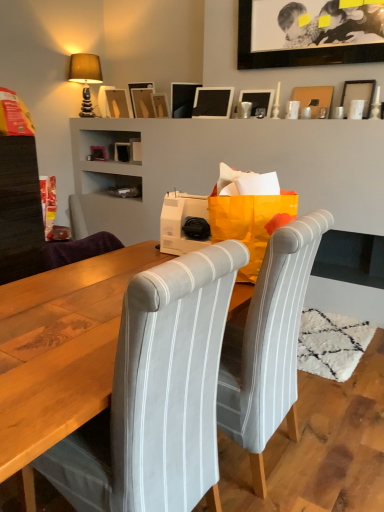
Looking at this image, in order to face matte black picture frame at upper center, acting as the 5th picture frame starting from the left, should I rotate leftwards or rightwards?

To face it directly, rotate right by 2.395 degrees.

Measure the distance between white striped fabric chair at center, marked as the 2th chair in a left-to-right arrangement, and camera.

A distance of 1.31 meters exists between white striped fabric chair at center, marked as the 2th chair in a left-to-right arrangement, and camera.

The width and height of the screenshot is (384, 512). What are the coordinates of `matte wood picture frame at upper center, marked as the 1th picture frame in a left-to-right arrangement` in the screenshot? It's located at (117, 103).

Find the location of a particular element. wooden picture frame at upper center, the seventh picture frame when ordered from right to left is located at coordinates (160, 105).

Image resolution: width=384 pixels, height=512 pixels. I want to click on matte black picture frame at upper center, acting as the 5th picture frame starting from the left, so click(x=213, y=102).

You are a GUI agent. You are given a task and a screenshot of the screen. Output one action in this format:
    pyautogui.click(x=<x>, y=<y>)
    Task: Click on the lamp that is on the left side of matte black picture frame at upper center, which ranks as the eighth picture frame in right-to-left order
    
    Given the screenshot: What is the action you would take?
    pyautogui.click(x=85, y=78)

Considering the relative positions of matte black picture frame at upper center, placed as the 2th picture frame when sorted from left to right, and matte brown fabric lampshade at upper left in the image provided, is matte black picture frame at upper center, placed as the 2th picture frame when sorted from left to right, to the right of matte brown fabric lampshade at upper left from the viewer's perspective?

Yes.

Is matte black picture frame at upper center, which ranks as the eighth picture frame in right-to-left order, with matte brown fabric lampshade at upper left?

matte black picture frame at upper center, which ranks as the eighth picture frame in right-to-left order, and matte brown fabric lampshade at upper left are not in contact.

How different are the orientations of matte black picture frame at upper center, which ranks as the eighth picture frame in right-to-left order, and matte brown fabric lampshade at upper left in degrees?

There is a 177-degree angle between the facing directions of matte black picture frame at upper center, which ranks as the eighth picture frame in right-to-left order, and matte brown fabric lampshade at upper left.

Is black matte picture frame at upper center, which ranks as the 3th picture frame in right-to-left order, bigger than wooden picture frame at upper center, the seventh picture frame when ordered from right to left?

Yes, black matte picture frame at upper center, which ranks as the 3th picture frame in right-to-left order, is bigger than wooden picture frame at upper center, the seventh picture frame when ordered from right to left.

Considering the positions of objects black matte picture frame at upper center, which ranks as the 3th picture frame in right-to-left order, and wooden picture frame at upper center, marked as the third picture frame in a left-to-right arrangement, in the image provided, who is more to the left, black matte picture frame at upper center, which ranks as the 3th picture frame in right-to-left order, or wooden picture frame at upper center, marked as the third picture frame in a left-to-right arrangement,?

wooden picture frame at upper center, marked as the third picture frame in a left-to-right arrangement, is more to the left.

Does black matte picture frame at upper center, which ranks as the 3th picture frame in right-to-left order, turn towards wooden picture frame at upper center, marked as the third picture frame in a left-to-right arrangement?

No.

Which object is closer to the camera, black matte picture frame at upper center, which ranks as the 3th picture frame in right-to-left order, or wooden picture frame at upper center, the seventh picture frame when ordered from right to left?

black matte picture frame at upper center, which ranks as the 3th picture frame in right-to-left order, is closer to the camera.

Is black matte picture frame at upper center, positioned as the seventh picture frame in left-to-right order, next to matte wood picture frame at upper center, the 9th picture frame viewed from the right, and touching it?

No, black matte picture frame at upper center, positioned as the seventh picture frame in left-to-right order, is not making contact with matte wood picture frame at upper center, the 9th picture frame viewed from the right.

From the image's perspective, which one is positioned lower, black matte picture frame at upper center, positioned as the seventh picture frame in left-to-right order, or matte wood picture frame at upper center, the 9th picture frame viewed from the right?

From the image's view, matte wood picture frame at upper center, the 9th picture frame viewed from the right, is below.

Locate an element on the screen. picture frame that is the 4th object directly below the black matte picture frame at upper center, which ranks as the 3th picture frame in right-to-left order (from a real-world perspective) is located at coordinates [x=117, y=103].

Is matte black picture frame at upper center, the 6th picture frame viewed from the left, bigger than matte black picture frame at upper center, acting as the 5th picture frame starting from the left?

No, matte black picture frame at upper center, the 6th picture frame viewed from the left, is not bigger than matte black picture frame at upper center, acting as the 5th picture frame starting from the left.

From a real-world perspective, which is physically below, matte black picture frame at upper center, the 4th picture frame when ordered from right to left, or matte black picture frame at upper center, acting as the 5th picture frame starting from the left?

matte black picture frame at upper center, the 4th picture frame when ordered from right to left.

In the scene shown: From the image's perspective, is matte black picture frame at upper center, the 6th picture frame viewed from the left, over matte black picture frame at upper center, acting as the 5th picture frame starting from the left?

Incorrect, from the image's perspective, matte black picture frame at upper center, the 6th picture frame viewed from the left, is lower than matte black picture frame at upper center, acting as the 5th picture frame starting from the left.

Which object is more forward, matte black picture frame at upper center, the 4th picture frame when ordered from right to left, or matte black picture frame at upper center, which is the 5th picture frame from right to left?

matte black picture frame at upper center, the 4th picture frame when ordered from right to left.

From the image's perspective, is gray fabric chair at center, arranged as the 2th chair when viewed from the right, above or below matte black picture frame at upper center, which ranks as the eighth picture frame in right-to-left order?

gray fabric chair at center, arranged as the 2th chair when viewed from the right, is below matte black picture frame at upper center, which ranks as the eighth picture frame in right-to-left order.

Considering the relative sizes of gray fabric chair at center, the 1th chair when ordered from left to right, and matte black picture frame at upper center, placed as the 2th picture frame when sorted from left to right, in the image provided, is gray fabric chair at center, the 1th chair when ordered from left to right, smaller than matte black picture frame at upper center, placed as the 2th picture frame when sorted from left to right,?

Incorrect, gray fabric chair at center, the 1th chair when ordered from left to right, is not smaller in size than matte black picture frame at upper center, placed as the 2th picture frame when sorted from left to right.

Which is closer to the camera, (163,471) or (153,88)?

Point (163,471).

In the image, is gray fabric chair at center, the 1th chair when ordered from left to right, on the left side or the right side of matte black picture frame at upper center, placed as the 2th picture frame when sorted from left to right?

From the image, it's evident that gray fabric chair at center, the 1th chair when ordered from left to right, is to the right of matte black picture frame at upper center, placed as the 2th picture frame when sorted from left to right.

Is matte black picture frame at upper center, acting as the 5th picture frame starting from the left, at the back of matte black picture frame at upper right, the ninth picture frame from the left?

No, matte black picture frame at upper right, the ninth picture frame from the left, is not facing away from matte black picture frame at upper center, acting as the 5th picture frame starting from the left.

From a real-world perspective, is matte black picture frame at upper right, which appears as the 1th picture frame when viewed from the right, positioned above or below matte black picture frame at upper center, acting as the 5th picture frame starting from the left?

matte black picture frame at upper right, which appears as the 1th picture frame when viewed from the right, is situated lower than matte black picture frame at upper center, acting as the 5th picture frame starting from the left, in the real world.

Which point is more distant from viewer, (370, 106) or (208, 103)?

The point (208, 103) is farther from the camera.

At what (x,y) coordinates should I click in order to perform the action: click on the 3rd picture frame behind when counting from the matte black picture frame at upper right, the ninth picture frame from the left. Please return your answer as a coordinate pair (x, y). Looking at the image, I should click on (213, 102).

Who is smaller, black matte picture frame at upper center, positioned as the seventh picture frame in left-to-right order, or white striped fabric chair at center, placed as the first chair when sorted from right to left?

black matte picture frame at upper center, positioned as the seventh picture frame in left-to-right order, is smaller.

Based on the photo, who is shorter, black matte picture frame at upper center, positioned as the seventh picture frame in left-to-right order, or white striped fabric chair at center, placed as the first chair when sorted from right to left?

Standing shorter between the two is black matte picture frame at upper center, positioned as the seventh picture frame in left-to-right order.

In the scene shown: How many degrees apart are the facing directions of black matte picture frame at upper center, positioned as the seventh picture frame in left-to-right order, and white striped fabric chair at center, marked as the 2th chair in a left-to-right arrangement?

The angle between the facing direction of black matte picture frame at upper center, positioned as the seventh picture frame in left-to-right order, and the facing direction of white striped fabric chair at center, marked as the 2th chair in a left-to-right arrangement, is 93.6 degrees.

Which is in front, point (243, 16) or point (296, 397)?

The point (296, 397) is in front.

Locate an element on the screen. This screenshot has height=512, width=384. lamp in front of the matte black picture frame at upper center, which ranks as the eighth picture frame in right-to-left order is located at coordinates (85, 78).

Which picture frame is the 5th one when counting from the back of the black matte picture frame at upper center, which ranks as the 3th picture frame in right-to-left order? Please provide its 2D coordinates.

[(160, 105)]

Considering their positions, is gray fabric chair at center, arranged as the 2th chair when viewed from the right, positioned closer to white striped fabric chair at center, marked as the 2th chair in a left-to-right arrangement, than matte wood picture frame at upper center, marked as the 1th picture frame in a left-to-right arrangement?

gray fabric chair at center, arranged as the 2th chair when viewed from the right, is closer to white striped fabric chair at center, marked as the 2th chair in a left-to-right arrangement.

Based on their spatial positions, is matte black picture frame at upper center, the 4th picture frame when ordered from right to left, or gray fabric chair at center, arranged as the 2th chair when viewed from the right, further from matte black picture frame at upper right, which appears as the 1th picture frame when viewed from the right?

gray fabric chair at center, arranged as the 2th chair when viewed from the right.

From the image, which object appears to be nearer to white striped fabric chair at center, placed as the first chair when sorted from right to left, matte black picture frame at upper center, the sixth picture frame positioned from the right, or matte black picture frame at upper center, the 4th picture frame when ordered from right to left?

matte black picture frame at upper center, the 4th picture frame when ordered from right to left, is positioned closer to the anchor white striped fabric chair at center, placed as the first chair when sorted from right to left.

From the image, which object appears to be nearer to matte black picture frame at upper center, the 4th picture frame when ordered from right to left, matte black picture frame at upper center, which ranks as the eighth picture frame in right-to-left order, or black matte picture frame at upper center, which ranks as the 3th picture frame in right-to-left order?

black matte picture frame at upper center, which ranks as the 3th picture frame in right-to-left order.

Which object lies further to the anchor point matte brown fabric lampshade at upper left, matte black picture frame at upper center, the 4th picture frame in the left-to-right sequence, or gray fabric chair at center, the 1th chair when ordered from left to right?

gray fabric chair at center, the 1th chair when ordered from left to right, lies further to matte brown fabric lampshade at upper left than the other object.

Which object lies nearer to the anchor point matte black picture frame at upper center, which ranks as the eighth picture frame in right-to-left order, black matte picture frame at upper center, positioned as the seventh picture frame in left-to-right order, or wooden picture frame at upper center, marked as the third picture frame in a left-to-right arrangement?

Among the two, wooden picture frame at upper center, marked as the third picture frame in a left-to-right arrangement, is located nearer to matte black picture frame at upper center, which ranks as the eighth picture frame in right-to-left order.

Estimate the real-world distances between objects in this image. Which object is closer to black matte picture frame at upper center, positioned as the seventh picture frame in left-to-right order, matte black picture frame at upper center, placed as the 2th picture frame when sorted from left to right, or gray fabric chair at center, the 1th chair when ordered from left to right?

Among the two, matte black picture frame at upper center, placed as the 2th picture frame when sorted from left to right, is located nearer to black matte picture frame at upper center, positioned as the seventh picture frame in left-to-right order.

Estimate the real-world distances between objects in this image. Which object is further from black matte picture frame at upper center, which ranks as the 3th picture frame in right-to-left order, wooden picture frame at upper center, the seventh picture frame when ordered from right to left, or matte wood picture frame at upper center, marked as the 1th picture frame in a left-to-right arrangement?

matte wood picture frame at upper center, marked as the 1th picture frame in a left-to-right arrangement, is positioned further to the anchor black matte picture frame at upper center, which ranks as the 3th picture frame in right-to-left order.

Locate an element on the screen. The height and width of the screenshot is (512, 384). lamp located between white striped fabric chair at center, placed as the first chair when sorted from right to left, and matte black picture frame at upper center, placed as the 2th picture frame when sorted from left to right, in the depth direction is located at coordinates (85, 78).

Identify the location of chair between gray fabric chair at center, the 1th chair when ordered from left to right, and matte black picture frame at upper center, placed as the 2th picture frame when sorted from left to right, in the front-back direction. Image resolution: width=384 pixels, height=512 pixels. (269, 344).

At what (x,y) coordinates should I click in order to perform the action: click on picture frame between matte black picture frame at upper center, which ranks as the eighth picture frame in right-to-left order, and matte black picture frame at upper center, the 4th picture frame in the left-to-right sequence, in the horizontal direction. Please return your answer as a coordinate pair (x, y). The image size is (384, 512). Looking at the image, I should click on (160, 105).

This screenshot has height=512, width=384. I want to click on chair between gray fabric chair at center, the 1th chair when ordered from left to right, and wooden picture frame at upper center, the seventh picture frame when ordered from right to left, in the front-back direction, so click(269, 344).